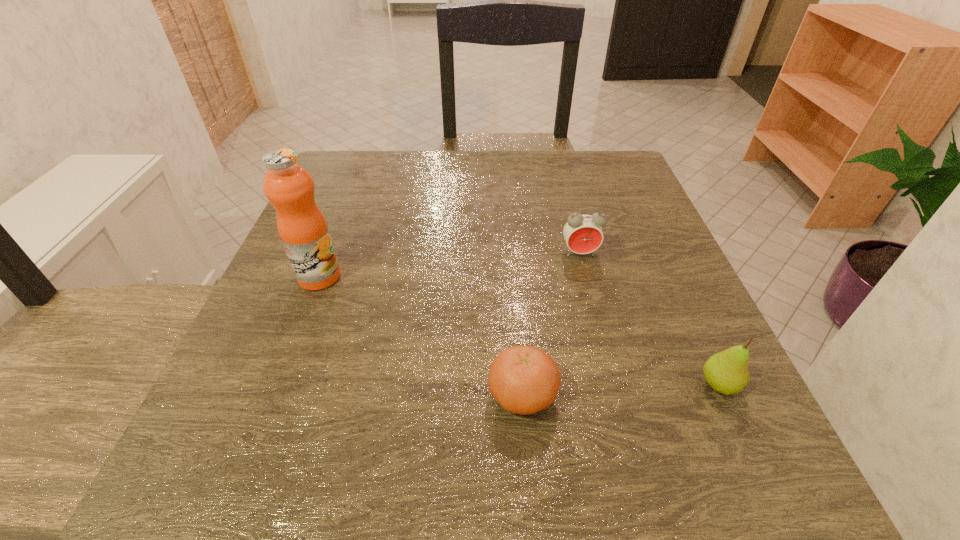
Where is `object identified as the third closest to the second object from left to right`? The image size is (960, 540). object identified as the third closest to the second object from left to right is located at coordinates (289, 187).

Identify the location of object that can be found as the second closest to the clementine. This screenshot has height=540, width=960. (583, 233).

Find the location of a particular element. vacant area in the image that satisfies the following two spatial constraints: 1. on the front side of the third nearest object; 2. on the right side of the rightmost object is located at coordinates (276, 386).

Locate an element on the screen. The height and width of the screenshot is (540, 960). vacant region that satisfies the following two spatial constraints: 1. on the face of the farthest object; 2. on the right side of the pear is located at coordinates (613, 386).

Image resolution: width=960 pixels, height=540 pixels. Find the location of `vacant area in the image that satisfies the following two spatial constraints: 1. on the face of the pear; 2. on the right side of the alarm clock`. vacant area in the image that satisfies the following two spatial constraints: 1. on the face of the pear; 2. on the right side of the alarm clock is located at coordinates (613, 386).